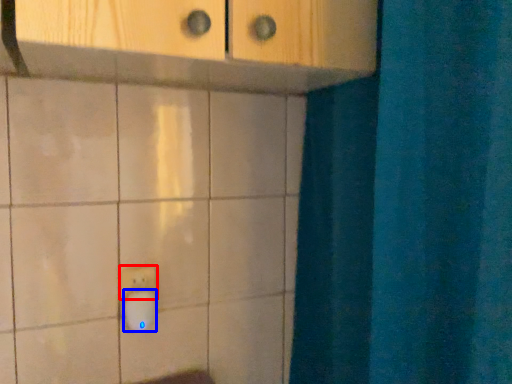
Question: Which object appears closest to the camera in this image, light switch (highlighted by a red box) or knob (highlighted by a blue box)?

Choices:
 (A) light switch
 (B) knob

Answer: (B)